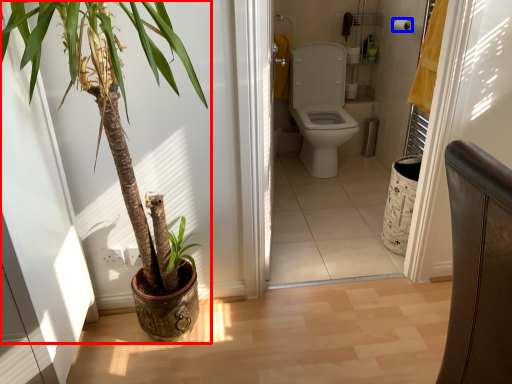
Question: Which object appears farthest to the camera in this image, houseplant (highlighted by a red box) or toilet paper (highlighted by a blue box)?

Choices:
 (A) houseplant
 (B) toilet paper

Answer: (B)